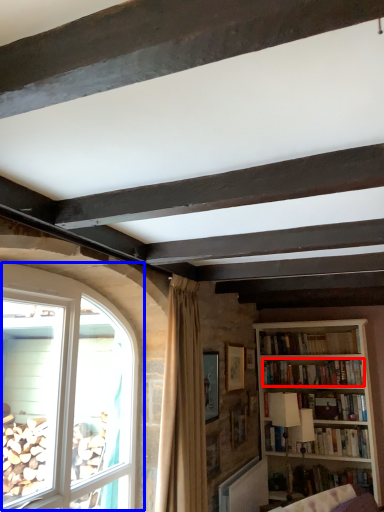
Question: Which of the following is the closest to the observer, book (highlighted by a red box) or window (highlighted by a blue box)?

Choices:
 (A) book
 (B) window

Answer: (B)